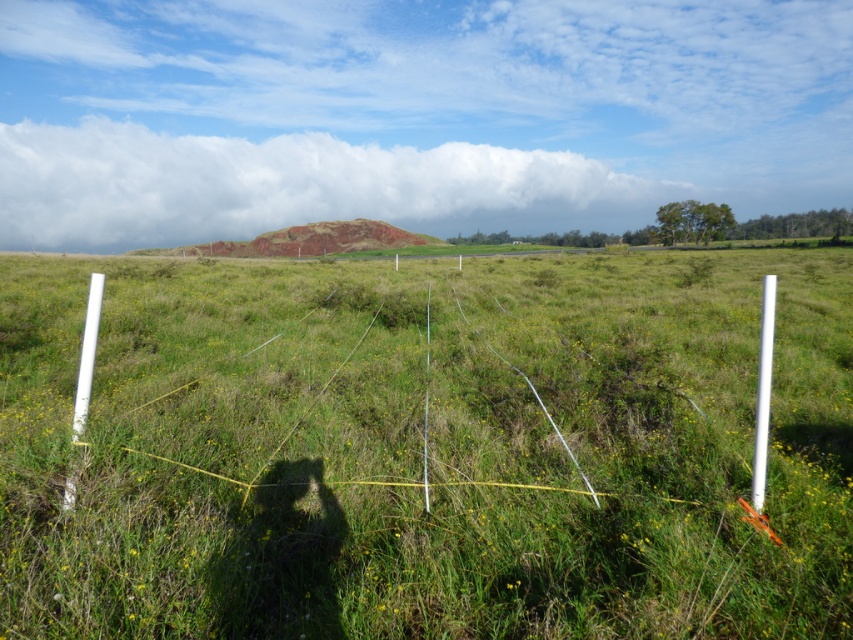
Question: Is the position of green grassy at center more distant than that of white plastic pole at right?

Choices:
 (A) no
 (B) yes

Answer: (A)

Question: Which of the following is the closest to the observer?

Choices:
 (A) green grassy at center
 (B) white plastic pole at right

Answer: (A)

Question: Can you confirm if green grassy at center is positioned to the left of white plastic pole at right?

Choices:
 (A) no
 (B) yes

Answer: (B)

Question: Which point is closer to the camera?

Choices:
 (A) green grassy at center
 (B) white plastic pole at right

Answer: (A)

Question: Is green grassy at center wider than white plastic pole at right?

Choices:
 (A) yes
 (B) no

Answer: (A)

Question: Which object is closer to the camera taking this photo?

Choices:
 (A) white plastic pole at right
 (B) green grassy at center

Answer: (B)